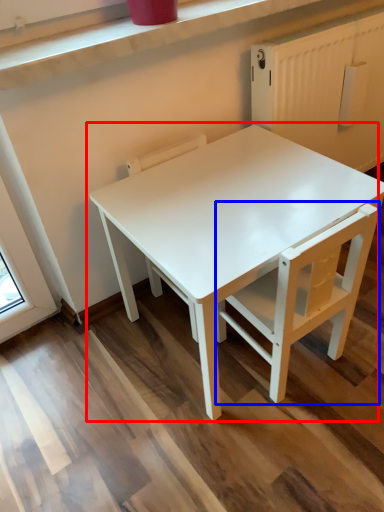
Question: Which object appears farthest to the camera in this image, table (highlighted by a red box) or chair (highlighted by a blue box)?

Choices:
 (A) table
 (B) chair

Answer: (B)